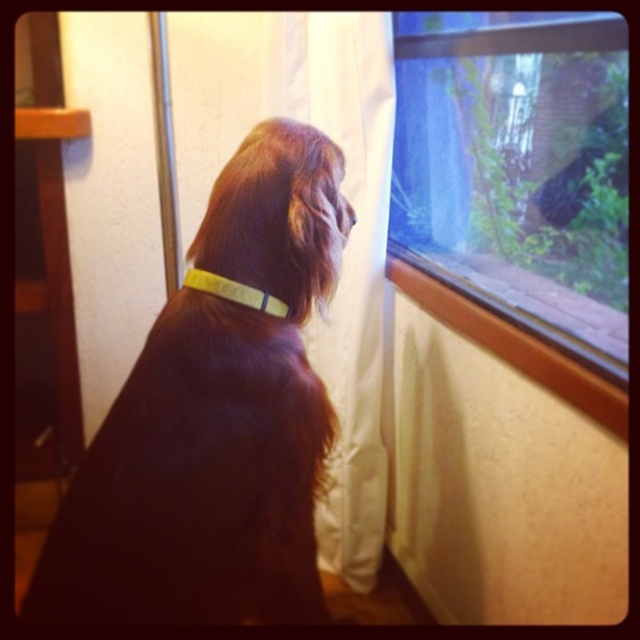
You are a dog owner who wants to ensure your dog can see outside through the transparent glass window at upper right. Considering the white fabric curtain at center, will the curtain block the dog from seeing through the window?

The transparent glass window at upper right is not as tall as the white fabric curtain at center, so the curtain may block part of the window, but since the window is shorter, the dog might still have a view through the unobstructed part of the window.

From the picture: You are a photographer capturing the dog from the front. You need to decide whether the yellow fabric neckband at center will block the view of the brown fur nose at upper center in your photo. Can you determine this based on their positions?

The yellow fabric neckband at center is taller than the brown fur nose at upper center, so the neckband may block the view of the nose in the photo.

Consider the image. You are standing in the room where the dog is sitting. You notice two points marked on the window. The first point is at coordinates point (259,291) and the second is at point (353,214). Which point is closer to you?

Point (259,291) is closer to the viewer than point (353,214).